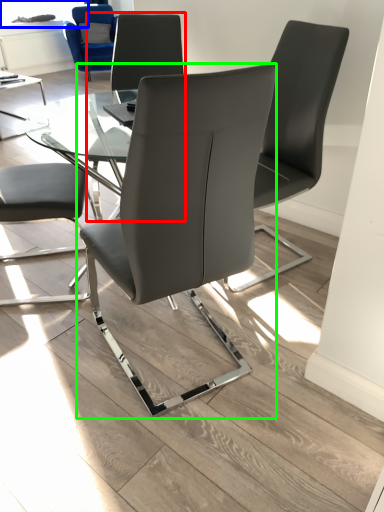
Question: Which is farther away from chair (highlighted by a red box)? window screen (highlighted by a blue box) or chair (highlighted by a green box)?

Choices:
 (A) window screen
 (B) chair

Answer: (A)